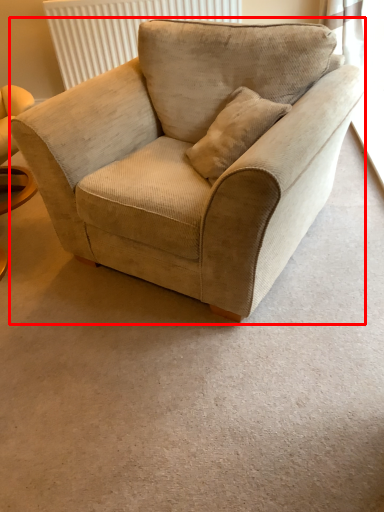
Question: From the image's perspective, considering the relative positions of chair (annotated by the red box) and radiator in the image provided, where is chair (annotated by the red box) located with respect to the staircase?

Choices:
 (A) above
 (B) below

Answer: (B)